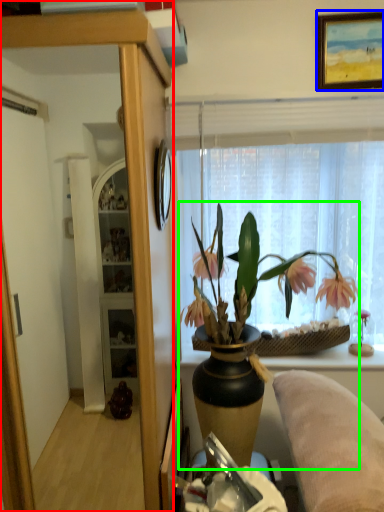
Question: Which is farther away from cabinetry (highlighted by a red box)? picture frame (highlighted by a blue box) or houseplant (highlighted by a green box)?

Choices:
 (A) picture frame
 (B) houseplant

Answer: (A)